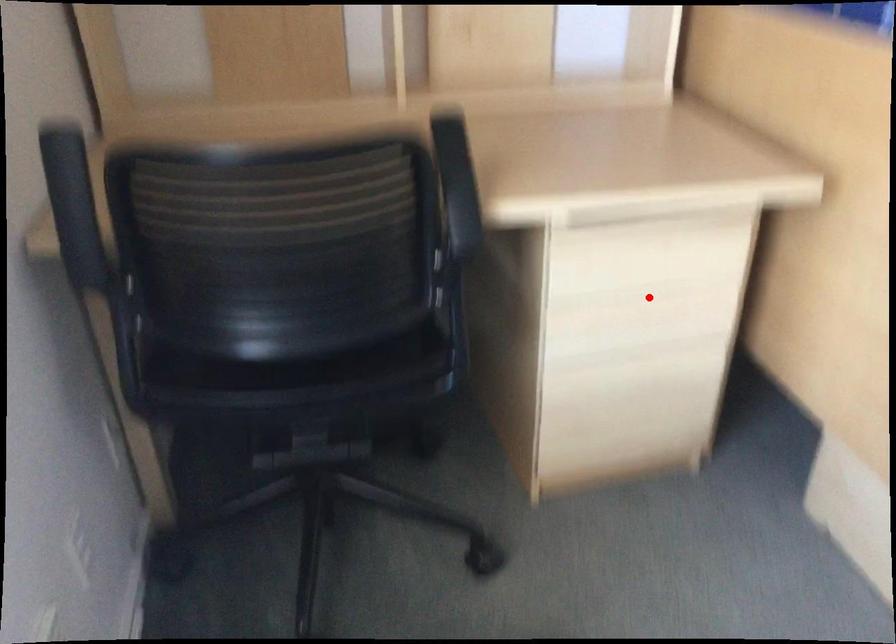
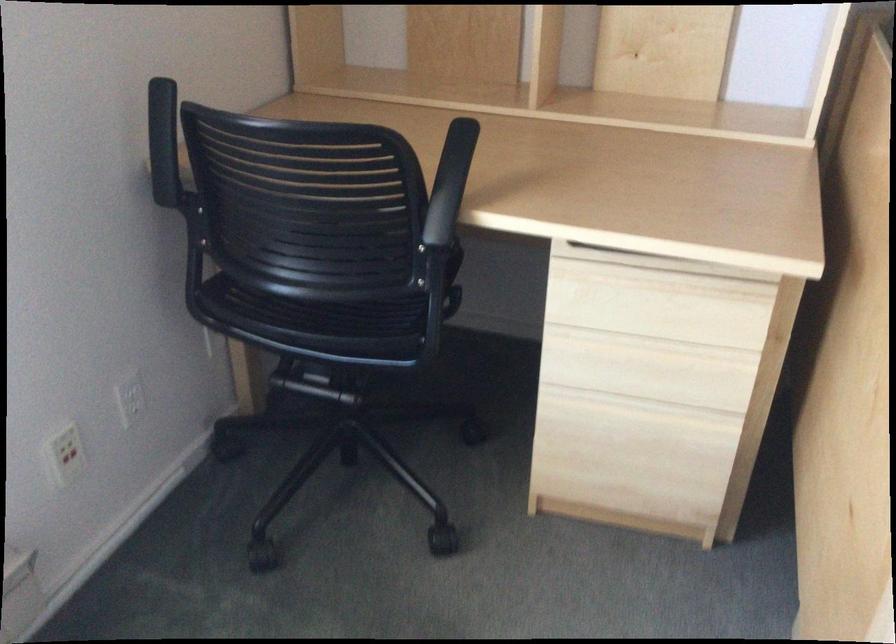
Find the pixel in the second image that matches the highlighted location in the first image.

(652, 345)